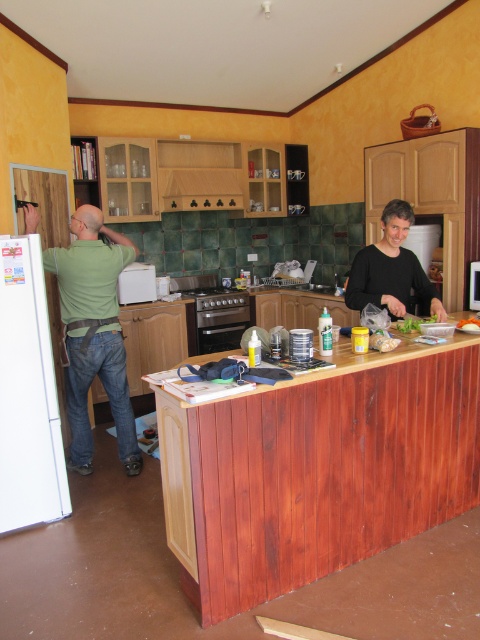
Question: In this image, where is white matte refrigerator at left located relative to wooden at center?

Choices:
 (A) left
 (B) right

Answer: (A)

Question: Considering the real-world distances, which object is farthest from the black matte shirt at center?

Choices:
 (A) wooden counter at center
 (B) wooden at center

Answer: (A)

Question: Which of the following is the closest to the observer?

Choices:
 (A) satin black oven at center
 (B) wooden counter at center
 (C) black matte shirt at center
 (D) wooden at center

Answer: (D)

Question: Is satin black oven at center positioned before wooden at center?

Choices:
 (A) no
 (B) yes

Answer: (A)

Question: Which is nearer to the white plastic microwave at center?

Choices:
 (A) black matte shirt at center
 (B) green matte shirt at left

Answer: (B)

Question: Is white matte refrigerator at left smaller than satin black oven at center?

Choices:
 (A) yes
 (B) no

Answer: (A)